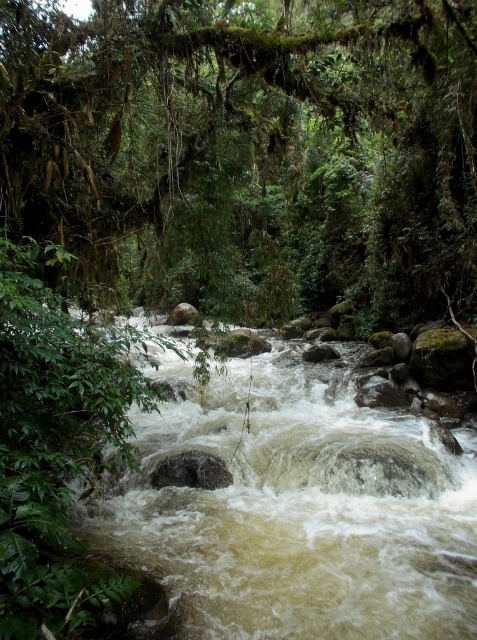
Question: Does green mossy tree at center lie in front of white frothy water at center?

Choices:
 (A) yes
 (B) no

Answer: (B)

Question: Among these points, which one is farthest from the camera?

Choices:
 (A) (383, 108)
 (B) (400, 525)

Answer: (A)

Question: Does green mossy tree at center come behind white frothy water at center?

Choices:
 (A) yes
 (B) no

Answer: (A)

Question: Is green mossy tree at center bigger than white frothy water at center?

Choices:
 (A) no
 (B) yes

Answer: (B)

Question: Which of the following is the closest to the observer?

Choices:
 (A) green mossy tree at center
 (B) white frothy water at center

Answer: (B)